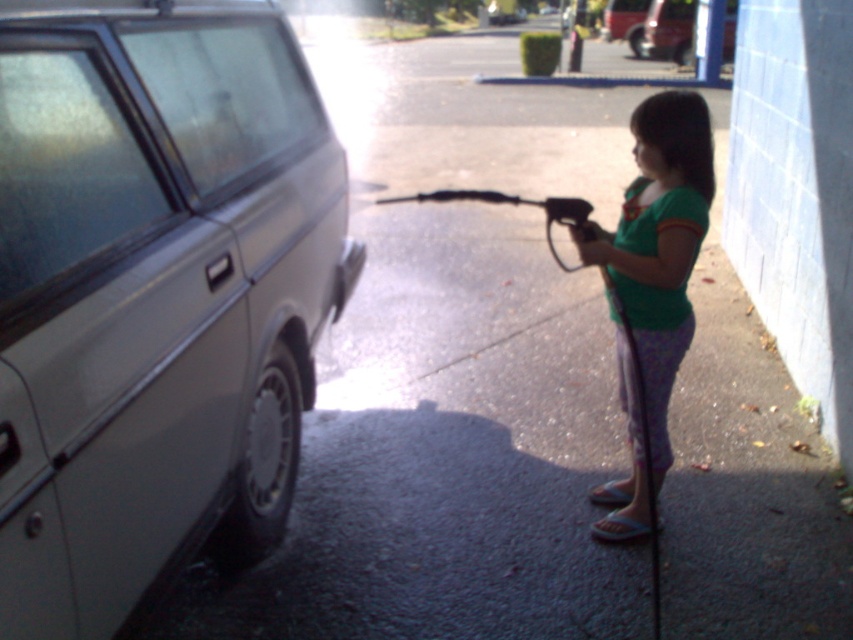
You are a photographer setting up a shoot in this car wash scene. You need to position a light source to avoid casting shadows on the matte silver minivan at left and the green fabric shirt at right. Based on their positions, where should you place the light source relative to these two objects?

The matte silver minivan at left is located above the green fabric shirt at right. To avoid casting shadows on both, the light source should be placed above and behind the matte silver minivan at left, ensuring that light falls downward onto both objects without creating shadows in their areas.

Consider the image. You are a pedestrian standing at the edge of the car wash area. You see the matte silver minivan at left and the green fabric shirt at right. Which object is closer to you?

The matte silver minivan at left is closer to you because it is positioned in front of the green fabric shirt at right.